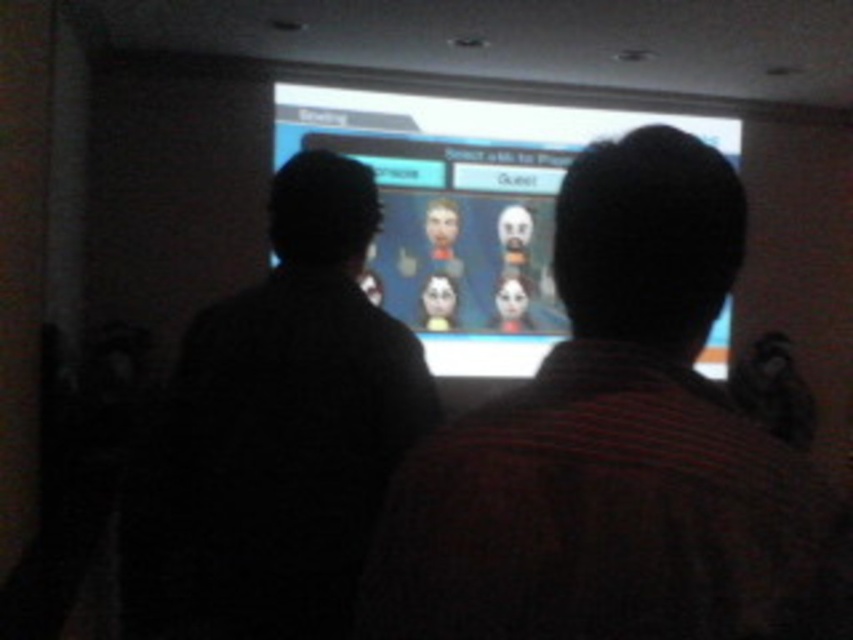
Measure the distance between striped fabric shirt at center and camera.

striped fabric shirt at center is 27.30 inches from camera.

Between striped fabric shirt at center and black matte shirt at left, which one has less height?

With less height is striped fabric shirt at center.

Is point (585, 412) closer to camera compared to point (289, 266)?

Yes, point (585, 412) is in front of point (289, 266).

Where is `striped fabric shirt at center`? This screenshot has width=853, height=640. striped fabric shirt at center is located at coordinates (614, 449).

Who is positioned more to the right, striped fabric shirt at center or matte plastic screen at center?

striped fabric shirt at center

Looking at this image, does striped fabric shirt at center come in front of matte plastic screen at center?

Yes, it is in front of matte plastic screen at center.

Find the location of a particular element. striped fabric shirt at center is located at coordinates (614, 449).

Where is `striped fabric shirt at center`? striped fabric shirt at center is located at coordinates (614, 449).

Does black matte shirt at left come in front of matte plastic screen at center?

Yes, black matte shirt at left is in front of matte plastic screen at center.

The height and width of the screenshot is (640, 853). I want to click on black matte shirt at left, so click(276, 433).